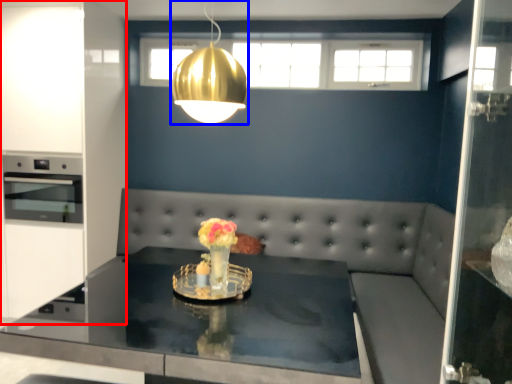
Question: Which point is further to the camera, cabinetry (highlighted by a red box) or light (highlighted by a blue box)?

Choices:
 (A) cabinetry
 (B) light

Answer: (A)